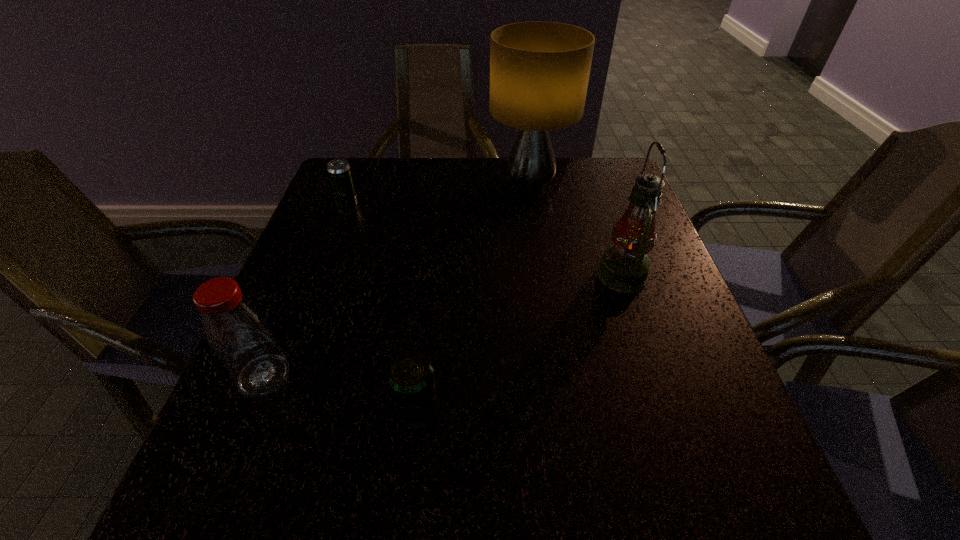
You are a GUI agent. You are given a task and a screenshot of the screen. Output one action in this format:
    pyautogui.click(x=<x>, y=<y>)
    Task: Click on the vacant space located on the back of the third shortest object
    The image size is (960, 540).
    Given the screenshot: What is the action you would take?
    pyautogui.click(x=297, y=296)

Identify the location of vacant space located on the back of the left beer can. (358, 178).

Find the location of a particular element. The width and height of the screenshot is (960, 540). free space located 0.130m on the back of the third object from right to left is located at coordinates click(x=425, y=329).

Identify the location of lampshade that is at the far edge. (539, 71).

Locate an element on the screen. Image resolution: width=960 pixels, height=540 pixels. beer can at the far edge is located at coordinates [x=339, y=171].

Locate an element on the screen. bottle located in the left edge section of the desktop is located at coordinates (238, 333).

Identify the location of beer can that is at the left edge. The image size is (960, 540). (339, 171).

Locate an element on the screen. object located at the right edge is located at coordinates (624, 267).

Locate an element on the screen. The image size is (960, 540). object present at the far left corner is located at coordinates (339, 171).

This screenshot has width=960, height=540. In the image, there is a desktop. What are the coordinates of `free space at the far edge` in the screenshot? It's located at (535, 193).